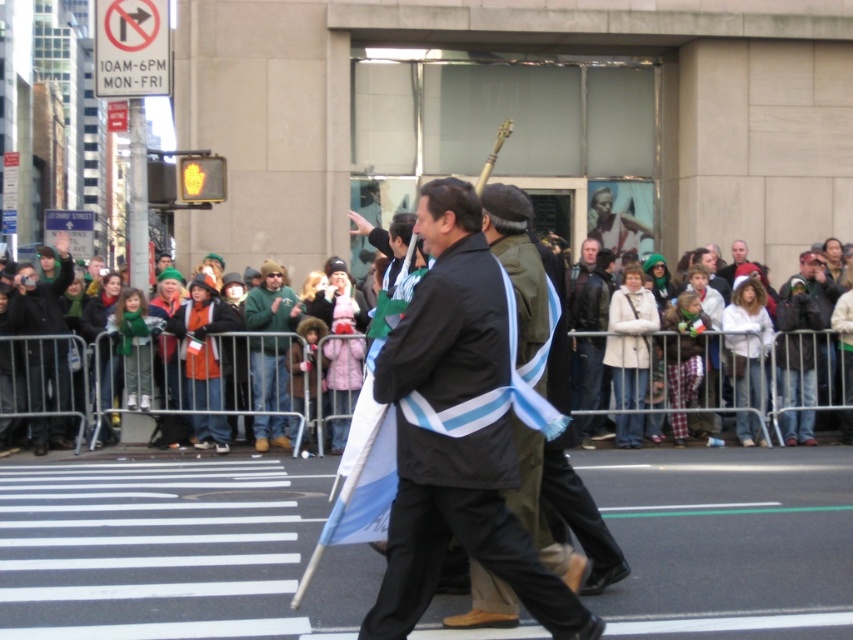
You are a photographer standing at the crosswalk trying to capture the parade. You notice the multicolored fabric at center and the matte black jacket at left. Which object is closer to your camera lens?

The multicolored fabric at center is closer to your camera lens because it is in front of the matte black jacket at left.

From the picture: You are a photographer standing at point (39, 296) in the image. What object is directly in front of you?

The matte black jacket at left is directly in front of you at point (39, 296).